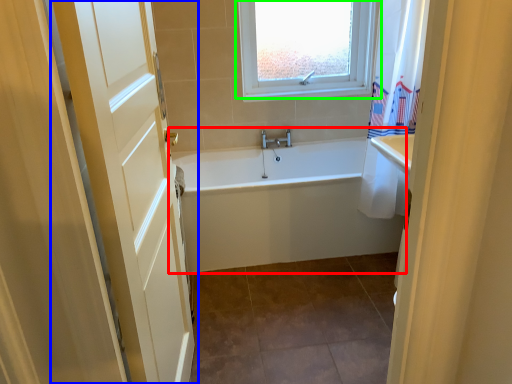
Question: Based on their relative distances, which object is farther from bathtub (highlighted by a red box)? Choose from door (highlighted by a blue box) and window (highlighted by a green box).

Choices:
 (A) door
 (B) window

Answer: (B)